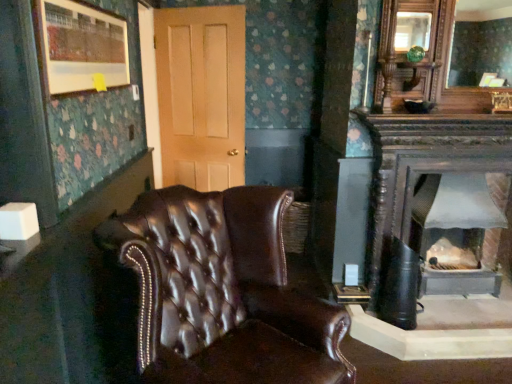
Question: Would you say gray metallic wood burning stove at right is part of matte wooden picture frame at upper left's contents?

Choices:
 (A) no
 (B) yes

Answer: (A)

Question: Is matte wooden picture frame at upper left to the right of gray metallic wood burning stove at right from the viewer's perspective?

Choices:
 (A) yes
 (B) no

Answer: (B)

Question: Is matte wooden picture frame at upper left smaller than gray metallic wood burning stove at right?

Choices:
 (A) yes
 (B) no

Answer: (A)

Question: Is matte wooden picture frame at upper left oriented away from gray metallic wood burning stove at right?

Choices:
 (A) no
 (B) yes

Answer: (A)

Question: Is matte wooden picture frame at upper left further to camera compared to gray metallic wood burning stove at right?

Choices:
 (A) yes
 (B) no

Answer: (B)

Question: Is brown leather chair at center taller or shorter than gray metallic wood burning stove at right?

Choices:
 (A) short
 (B) tall

Answer: (B)

Question: From the image's perspective, is brown leather chair at center above or below gray metallic wood burning stove at right?

Choices:
 (A) above
 (B) below

Answer: (B)

Question: Is brown leather chair at center inside or outside of gray metallic wood burning stove at right?

Choices:
 (A) inside
 (B) outside

Answer: (B)

Question: Based on their sizes in the image, would you say brown leather chair at center is bigger or smaller than gray metallic wood burning stove at right?

Choices:
 (A) small
 (B) big

Answer: (B)

Question: From the image's perspective, is matte wooden picture frame at upper left positioned above or below gray metallic wood burning stove at right?

Choices:
 (A) below
 (B) above

Answer: (B)

Question: Considering the positions of matte wooden picture frame at upper left and gray metallic wood burning stove at right in the image, is matte wooden picture frame at upper left taller or shorter than gray metallic wood burning stove at right?

Choices:
 (A) short
 (B) tall

Answer: (A)

Question: Is point pyautogui.click(x=117, y=72) closer or farther from the camera than point pyautogui.click(x=480, y=253)?

Choices:
 (A) farther
 (B) closer

Answer: (B)

Question: From a real-world perspective, is matte wooden picture frame at upper left above or below gray metallic wood burning stove at right?

Choices:
 (A) below
 (B) above

Answer: (B)

Question: Is gray metallic wood burning stove at right taller or shorter than matte wooden mirror at upper right?

Choices:
 (A) short
 (B) tall

Answer: (B)

Question: Would you say gray metallic wood burning stove at right is inside or outside matte wooden mirror at upper right?

Choices:
 (A) inside
 (B) outside

Answer: (B)